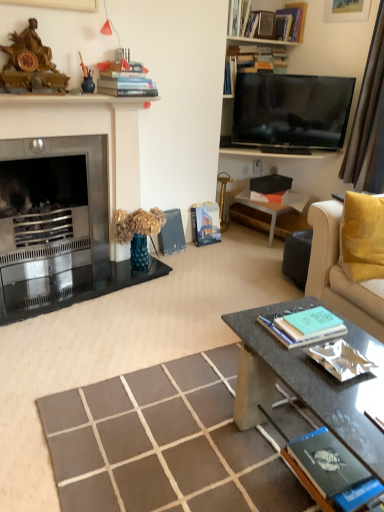
The height and width of the screenshot is (512, 384). I want to click on vacant space that is to the left of shiny metallic book at center-right, the eighth book positioned from the top, so click(291, 365).